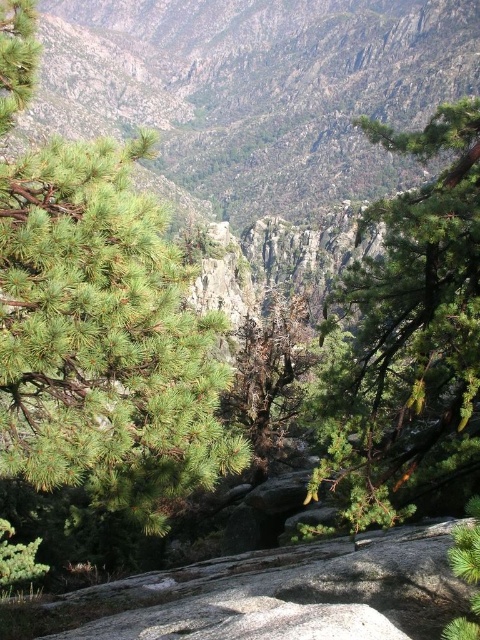
Question: Among these points, which one is farthest from the camera?

Choices:
 (A) (100, 349)
 (B) (107, 106)
 (C) (388, 268)

Answer: (B)

Question: Can you confirm if green needle-like at center is positioned to the right of green textured mountain at upper center?

Choices:
 (A) yes
 (B) no

Answer: (A)

Question: Does green needle-like at center appear under green needle-like tree at center?

Choices:
 (A) no
 (B) yes

Answer: (B)

Question: Among these objects, which one is nearest to the camera?

Choices:
 (A) green needle-like tree at center
 (B) green needle-like at center
 (C) green textured mountain at upper center

Answer: (B)

Question: Which point is closer to the camera taking this photo?

Choices:
 (A) (199, 83)
 (B) (54, 230)

Answer: (B)

Question: Does green needle-like at center appear on the left side of green textured mountain at upper center?

Choices:
 (A) yes
 (B) no

Answer: (B)